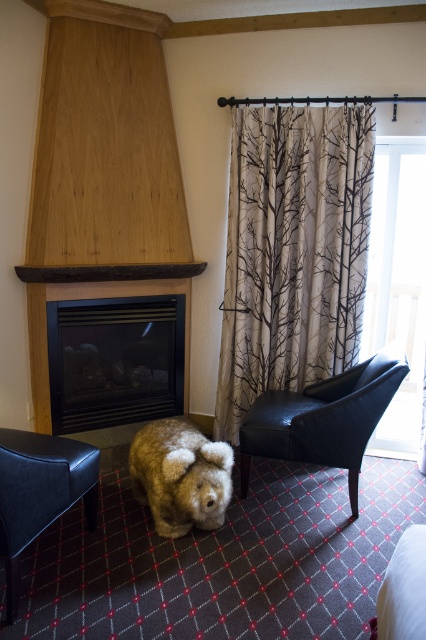
Is beige fabric curtain with tree branches at center taller than black leather armchair at center-right?

Yes.

Is beige fabric curtain with tree branches at center wider than black leather armchair at center-right?

Yes.

Between point (241, 124) and point (368, 397), which one is positioned in front?

Point (368, 397) is more forward.

This screenshot has width=426, height=640. In order to click on beige fabric curtain with tree branches at center in this screenshot , I will do `click(293, 250)`.

Does point (167, 365) lie in front of point (178, 522)?

No, it is behind (178, 522).

Between black glass fireplace at center and fuzzy brown stuffed animal at lower center, which one appears on the right side from the viewer's perspective?

fuzzy brown stuffed animal at lower center is more to the right.

Is point (75, 337) closer to camera compared to point (190, 460)?

No, (75, 337) is further to viewer.

Image resolution: width=426 pixels, height=640 pixels. Find the location of `black glass fireplace at center`. black glass fireplace at center is located at coordinates (115, 360).

Does black glass fireplace at center have a larger size compared to leather armchair at lower left?

Indeed, black glass fireplace at center has a larger size compared to leather armchair at lower left.

Between black glass fireplace at center and leather armchair at lower left, which one appears on the right side from the viewer's perspective?

black glass fireplace at center

Which is in front, point (166, 304) or point (3, 440)?

Point (3, 440) is more forward.

Locate an element on the screen. The width and height of the screenshot is (426, 640). black glass fireplace at center is located at coordinates (115, 360).